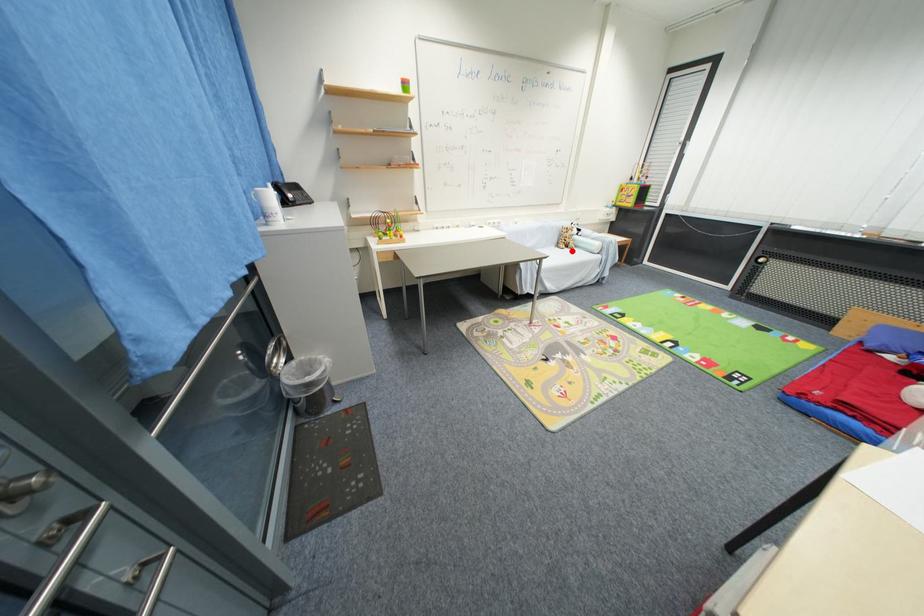
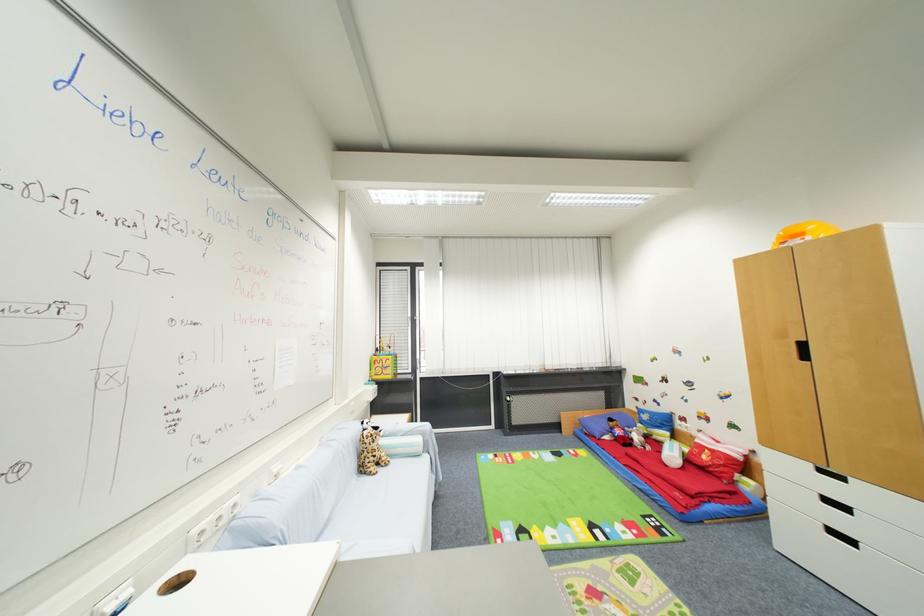
Question: I am providing you with two images of the same scene from different viewpoints. A red point is shown in image1. For the corresponding object point in image2, is it positioned nearer or farther from the camera?

Choices:
 (A) Nearer
 (B) Farther

Answer: (A)